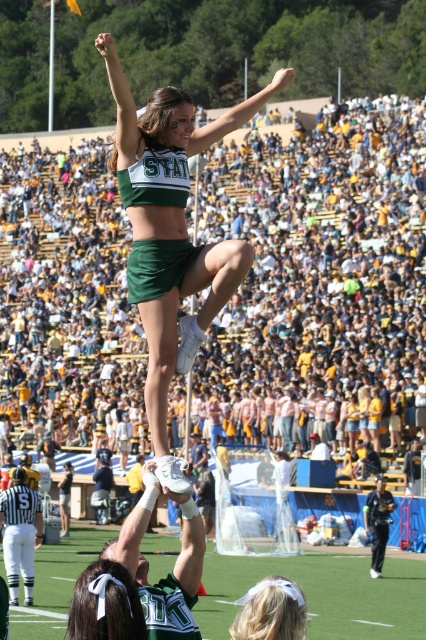
Between yellow and white crowd at upper center and green matte uniform at center, which one appears on the right side from the viewer's perspective?

From the viewer's perspective, green matte uniform at center appears more on the right side.

Between yellow and white crowd at upper center and green matte uniform at center, which one has less height?

With less height is yellow and white crowd at upper center.

Where is `yellow and white crowd at upper center`? The width and height of the screenshot is (426, 640). yellow and white crowd at upper center is located at coordinates (319, 276).

Who is higher up, yellow and white crowd at upper center or green turf football field at center?

yellow and white crowd at upper center

Is yellow and white crowd at upper center behind green turf football field at center?

That is True.

Does point (397, 252) lie behind point (388, 614)?

Yes.

Identify the location of yellow and white crowd at upper center. (319, 276).

Does green matte uniform at center have a larger size compared to green turf football field at center?

Indeed, green matte uniform at center has a larger size compared to green turf football field at center.

Who is more distant from viewer, (x=233, y=120) or (x=227, y=625)?

Point (x=227, y=625)

Is point (115, 161) less distant than point (224, 614)?

That is True.

The image size is (426, 640). I want to click on green matte uniform at center, so click(x=170, y=232).